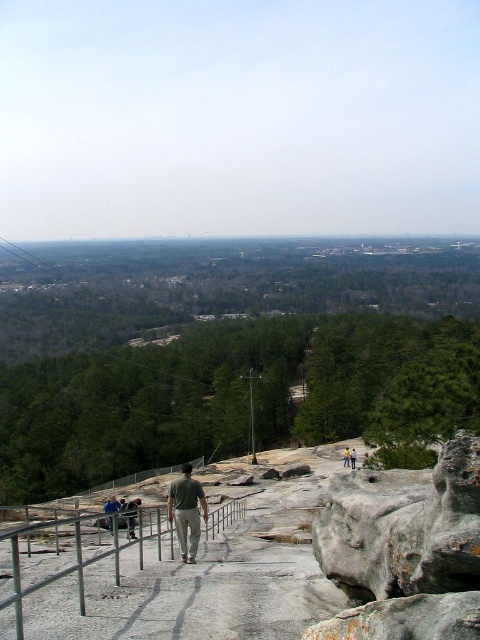
Is point (264, 595) positioned behind point (184, 464)?

No, it is not.

Who is positioned more to the left, gray stone path at center or green matte shirt at center?

Positioned to the left is green matte shirt at center.

You are a GUI agent. You are given a task and a screenshot of the screen. Output one action in this format:
    pyautogui.click(x=<x>, y=<y>)
    Task: Click on the gray stone path at center
    
    Given the screenshot: What is the action you would take?
    pyautogui.click(x=211, y=576)

What are the coordinates of `gray stone path at center` in the screenshot? It's located at (211, 576).

This screenshot has width=480, height=640. Describe the element at coordinates (404, 548) in the screenshot. I see `rusty stone boulder at center` at that location.

Is rusty stone boulder at center taller than light blue shirt at center?

Yes.

Which is in front, point (442, 609) or point (348, 456)?

Point (442, 609) is in front.

Where is `rusty stone boulder at center`? The height and width of the screenshot is (640, 480). rusty stone boulder at center is located at coordinates (404, 548).

Looking at this image, can you confirm if green matte shirt at center is positioned to the right of dark gray pants at center?

Indeed, green matte shirt at center is positioned on the right side of dark gray pants at center.

Is the position of green matte shirt at center less distant than that of dark gray pants at center?

Yes, it is.

Does point (182, 518) come closer to viewer compared to point (127, 512)?

Yes.

Find the location of a particular element. green matte shirt at center is located at coordinates (187, 512).